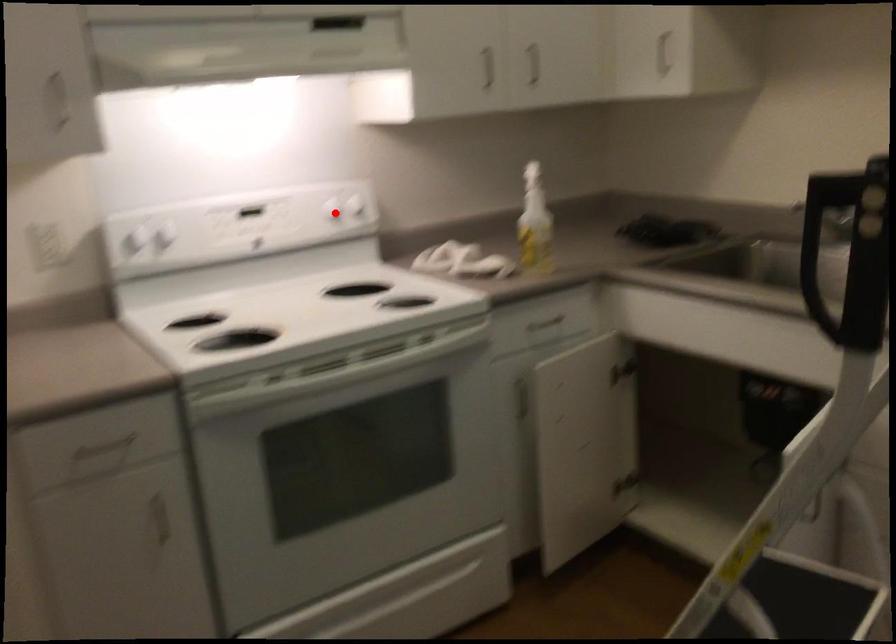
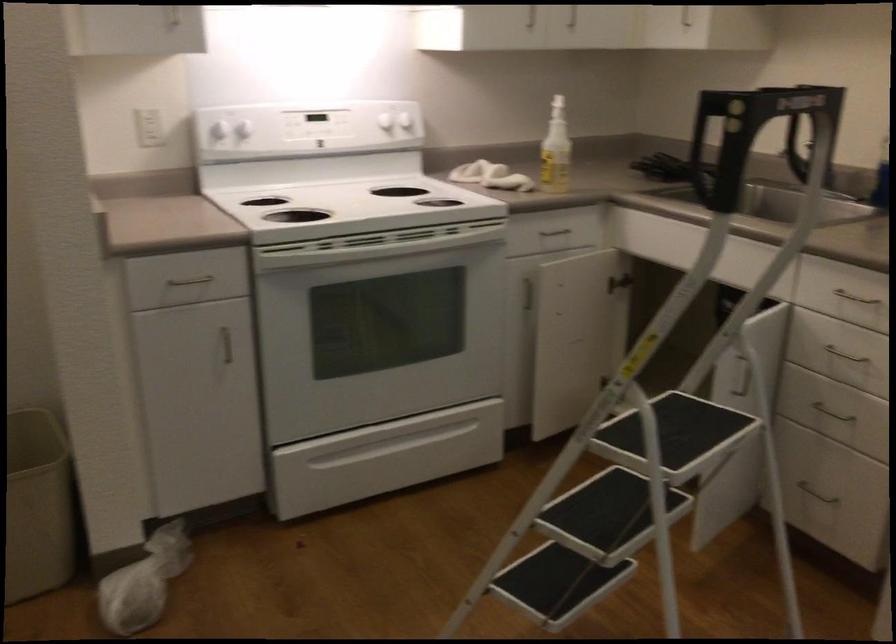
Locate, in the second image, the point that corresponds to the highlighted location in the first image.

(384, 120)